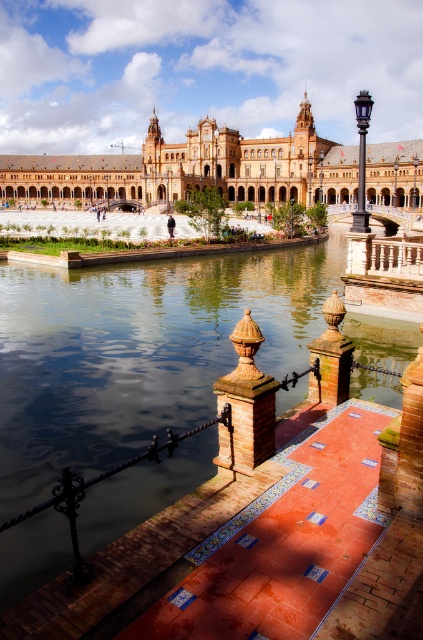
You are standing on the walkway and want to see the polished bronze pillar at center. Will it be visible above or below the clear water at center?

The polished bronze pillar at center is below the clear water at center, so it will be visible below the water.